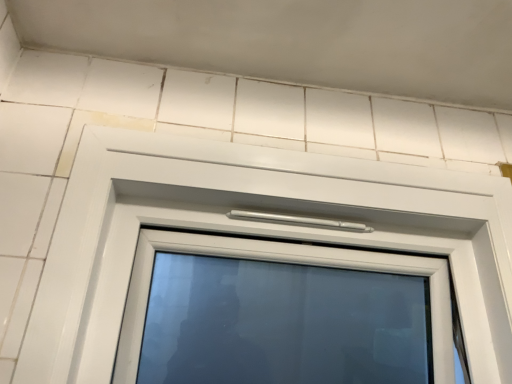
This screenshot has height=384, width=512. Describe the element at coordinates (267, 229) in the screenshot. I see `white plastic window at center` at that location.

What is the approximate height of white plastic window at center?

It is 24.62 inches.

Image resolution: width=512 pixels, height=384 pixels. Identify the location of white plastic window at center. (267, 229).

What is the approximate width of white plastic window at center?

It is 11.73 inches.

Where is `white plastic window at center`? white plastic window at center is located at coordinates (267, 229).